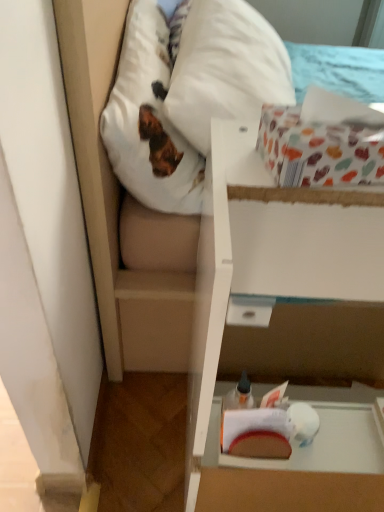
Question: From a real-world perspective, is white soft pillow at upper left physically below patterned paper box at upper right, the second cardboard box from the bottom?

Choices:
 (A) yes
 (B) no

Answer: (A)

Question: Are white soft pillow at upper left and patterned paper box at upper right, marked as the 1th cardboard box in a top-to-bottom arrangement, far apart?

Choices:
 (A) no
 (B) yes

Answer: (A)

Question: From the image's perspective, is white soft pillow at upper left beneath patterned paper box at upper right, the second cardboard box from the bottom?

Choices:
 (A) no
 (B) yes

Answer: (A)

Question: Is patterned paper box at upper right, the second cardboard box from the bottom, a part of white soft pillow at upper left?

Choices:
 (A) no
 (B) yes

Answer: (A)

Question: Does white soft pillow at upper left have a smaller size compared to patterned paper box at upper right, marked as the 1th cardboard box in a top-to-bottom arrangement?

Choices:
 (A) yes
 (B) no

Answer: (B)

Question: Considering the relative sizes of white soft pillow at upper left and patterned paper box at upper right, marked as the 1th cardboard box in a top-to-bottom arrangement, in the image provided, is white soft pillow at upper left wider than patterned paper box at upper right, marked as the 1th cardboard box in a top-to-bottom arrangement,?

Choices:
 (A) yes
 (B) no

Answer: (A)

Question: Can you see white fabric mattress at upper center touching white soft pillow at upper left?

Choices:
 (A) yes
 (B) no

Answer: (A)

Question: From the image's perspective, is white fabric mattress at upper center on top of white soft pillow at upper left?

Choices:
 (A) no
 (B) yes

Answer: (A)

Question: Does white fabric mattress at upper center have a greater height compared to white soft pillow at upper left?

Choices:
 (A) yes
 (B) no

Answer: (A)

Question: Is white fabric mattress at upper center further to the viewer compared to white soft pillow at upper left?

Choices:
 (A) no
 (B) yes

Answer: (B)

Question: Is white soft pillow at upper left located within white fabric mattress at upper center?

Choices:
 (A) no
 (B) yes

Answer: (B)

Question: Does white fabric mattress at upper center have a greater width compared to white soft pillow at upper left?

Choices:
 (A) yes
 (B) no

Answer: (A)

Question: Considering the relative positions of white cardboard box at center, which ranks as the 1th cardboard box in bottom-to-top order, and white fabric mattress at upper center in the image provided, is white cardboard box at center, which ranks as the 1th cardboard box in bottom-to-top order, behind white fabric mattress at upper center?

Choices:
 (A) yes
 (B) no

Answer: (B)